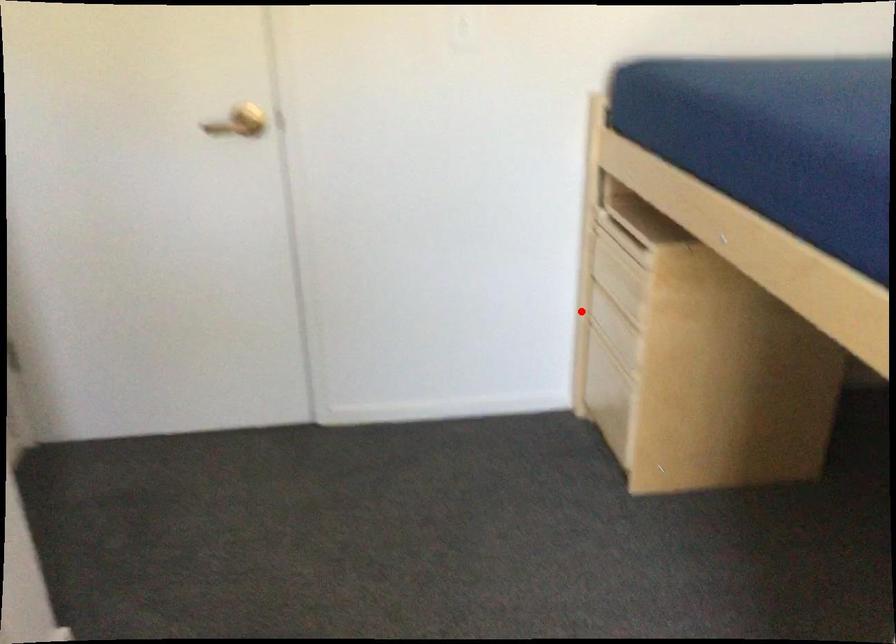
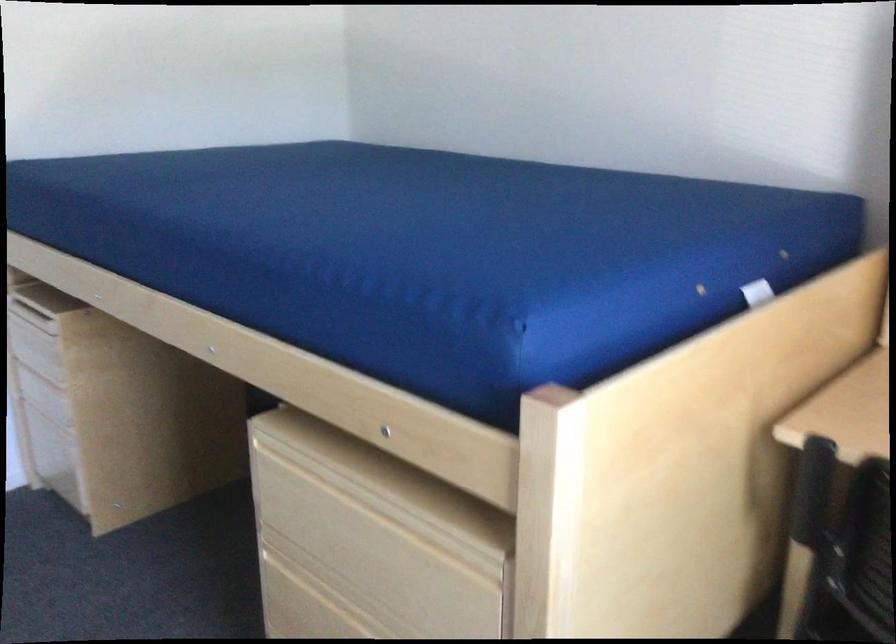
Locate, in the second image, the point that corresponds to the highlighted location in the first image.

(19, 395)